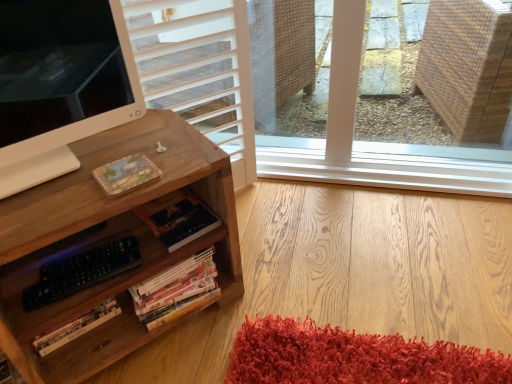
Question: Choose the correct answer: Is hardcover books at lower center, which is counted as the 2th book, starting from the top, inside wooden desk at left or outside it?

Choices:
 (A) inside
 (B) outside

Answer: (A)

Question: Looking at the image, does hardcover books at lower center, which is counted as the 2th book, starting from the top, seem bigger or smaller compared to wooden desk at left?

Choices:
 (A) big
 (B) small

Answer: (B)

Question: Which of these objects is positioned farthest from the hardcover books at lower center, marked as the 1th book in a bottom-to-top arrangement?

Choices:
 (A) wooden desk at left
 (B) hardcover book at center, the 1th book viewed from the top

Answer: (A)

Question: Based on their relative distances, which object is farther from the hardcover books at lower center, marked as the 1th book in a bottom-to-top arrangement?

Choices:
 (A) hardcover book at center, the 1th book viewed from the top
 (B) wooden desk at left

Answer: (B)